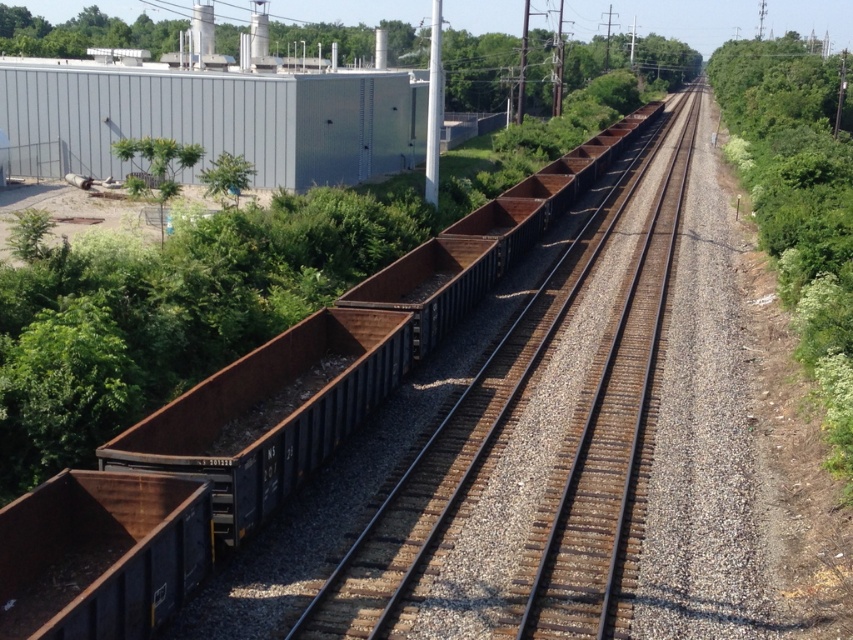
Question: Does green leafy tree at upper center appear on the left side of green leafy tree at upper left?

Choices:
 (A) no
 (B) yes

Answer: (B)

Question: Is rusty metal train car at lower left to the left of green leafy tree at upper left from the viewer's perspective?

Choices:
 (A) no
 (B) yes

Answer: (A)

Question: Which object appears closest to the camera in this image?

Choices:
 (A) green leafy tree at upper left
 (B) rusty metal train car at lower left
 (C) rusty metal train car at center
 (D) rusty metal train track at center

Answer: (B)

Question: From the image, what is the correct spatial relationship of rusty metal train track at center in relation to green leafy tree at upper left?

Choices:
 (A) left
 (B) right

Answer: (B)

Question: Which point is farther to the camera?

Choices:
 (A) green leafy tree at upper left
 (B) green leafy tree at upper center
 (C) rusty metal train car at center
 (D) rusty metal train track at center

Answer: (B)

Question: Which of the following is the farthest from the observer?

Choices:
 (A) (668, 280)
 (B) (675, 77)
 (C) (142, 518)
 (D) (225, 198)

Answer: (B)